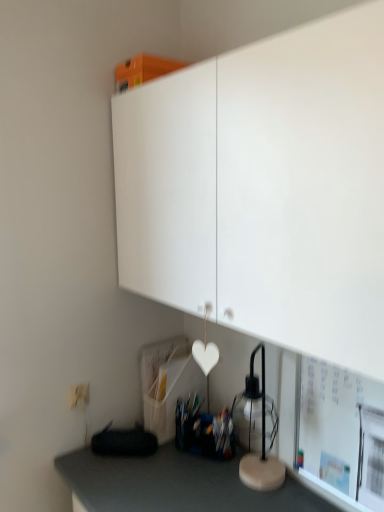
Question: Does transparent glass table lamp at lower right lie behind white matte cabinet at upper center?

Choices:
 (A) no
 (B) yes

Answer: (B)

Question: Does transparent glass table lamp at lower right have a larger size compared to white matte cabinet at upper center?

Choices:
 (A) no
 (B) yes

Answer: (A)

Question: Could white matte cabinet at upper center be considered to be inside transparent glass table lamp at lower right?

Choices:
 (A) yes
 (B) no

Answer: (B)

Question: Does transparent glass table lamp at lower right have a greater width compared to white matte cabinet at upper center?

Choices:
 (A) yes
 (B) no

Answer: (B)

Question: From a real-world perspective, does transparent glass table lamp at lower right stand above white matte cabinet at upper center?

Choices:
 (A) yes
 (B) no

Answer: (B)

Question: Is transparent glass table lamp at lower right at the left side of white matte cabinet at upper center?

Choices:
 (A) no
 (B) yes

Answer: (A)

Question: From the image's perspective, is white matte cabinet at upper center above white matte bulletin board at lower right?

Choices:
 (A) yes
 (B) no

Answer: (A)

Question: Is white matte cabinet at upper center taller than white matte bulletin board at lower right?

Choices:
 (A) yes
 (B) no

Answer: (A)

Question: Can we say white matte cabinet at upper center lies outside white matte bulletin board at lower right?

Choices:
 (A) no
 (B) yes

Answer: (B)

Question: Is the depth of white matte cabinet at upper center less than that of white matte bulletin board at lower right?

Choices:
 (A) yes
 (B) no

Answer: (A)

Question: Considering the relative sizes of white matte cabinet at upper center and white matte bulletin board at lower right in the image provided, is white matte cabinet at upper center bigger than white matte bulletin board at lower right?

Choices:
 (A) yes
 (B) no

Answer: (A)

Question: From the image's perspective, does white matte cabinet at upper center appear lower than white matte bulletin board at lower right?

Choices:
 (A) no
 (B) yes

Answer: (A)

Question: Would you say white matte cabinet at upper center is a long distance from transparent glass table lamp at lower right?

Choices:
 (A) no
 (B) yes

Answer: (A)